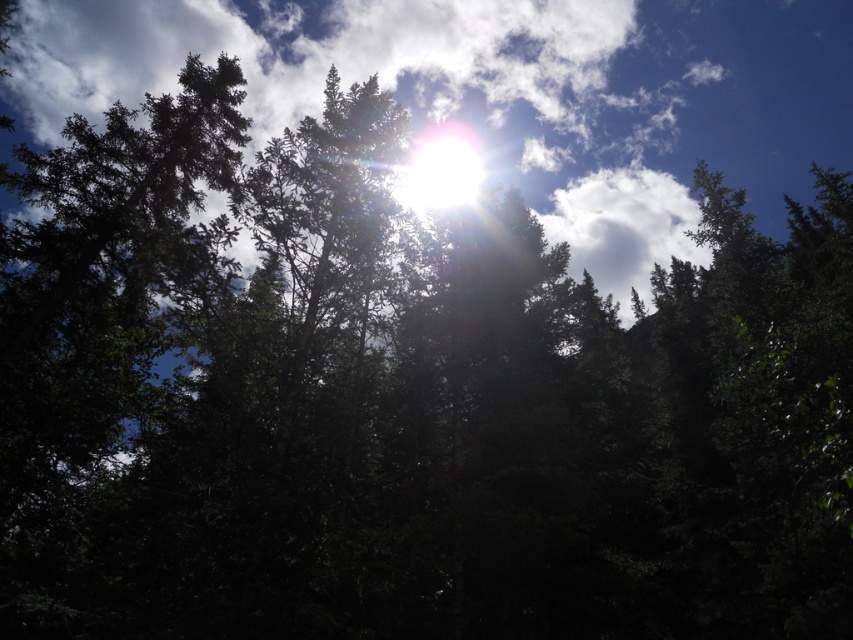
From the picture: You are an astronomer analyzing the forest canopy image. You need to determine if there is a cloud visible in the upper center area. Based on the coordinates provided, can you confirm the presence of a cloud at point (410, 93)?

Yes, the point (410, 93) marks a white fluffy cloud at upper center, so there is a cloud present at that location.

You are standing in the forest and see two points marked in the image. Which point is closer to you, point (627, 19) or point (428, 196)?

Point (627, 19) is further to the viewer than point (428, 196), so point (428, 196) is closer to you.

You are an astronomer observing the sky through a telescope. You notice the white fluffy cloud at upper center and the bright white sun at upper center. Which object appears bigger in your telescope view?

The white fluffy cloud at upper center appears bigger in the telescope view because it is larger in size than the bright white sun at upper center.